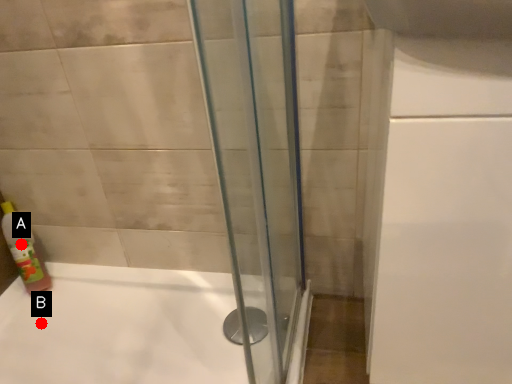
Question: Two points are circled on the image, labeled by A and B beside each circle. Among these points, which one is nearest to the camera?

Choices:
 (A) A is closer
 (B) B is closer

Answer: (B)